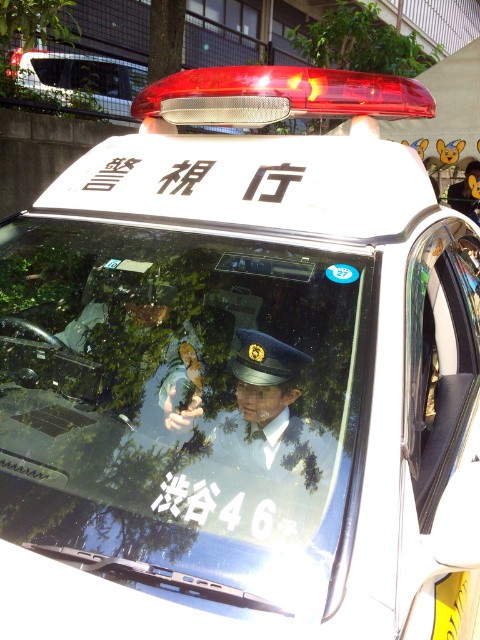
Looking at this image, you are a delivery person who needs to deliver a package to the white glossy sedan at upper left. The GPS coordinates of the sedan are at point (81, 77). If you are currently at point 0.25, 0.25, which direction should you move to reach the sedan?

The white glossy sedan at upper left is located at point (81, 77). Since your current position is at 0.25, 0.25, you should move northwest to reach the sedan.

You are a pedestrian standing on the sidewalk and see the white glossy sedan at upper left and the matte black uniform at center. Which object is closer to you?

The white glossy sedan at upper left is closer to you because the matte black uniform at center is behind it.